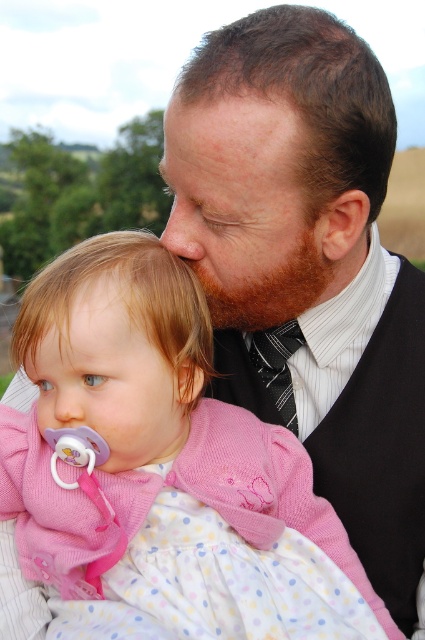
Question: Which point is closer to the camera?

Choices:
 (A) (161, 396)
 (B) (260, 285)
 (C) (209, 554)

Answer: (C)

Question: Does brown fuzzy beard at center have a lesser width compared to black silk tie at center?

Choices:
 (A) no
 (B) yes

Answer: (A)

Question: Among these points, which one is farthest from the camera?

Choices:
 (A) (85, 394)
 (B) (339, 230)
 (C) (218, 324)

Answer: (C)

Question: Does smooth black tie at center have a larger size compared to brown fuzzy beard at center?

Choices:
 (A) yes
 (B) no

Answer: (A)

Question: Can you confirm if brown fuzzy beard at center is thinner than black silk tie at center?

Choices:
 (A) no
 (B) yes

Answer: (A)

Question: Which of the following is the farthest from the observer?

Choices:
 (A) (263, 365)
 (B) (195, 234)
 (C) (146, 314)
 (D) (272, 326)

Answer: (A)